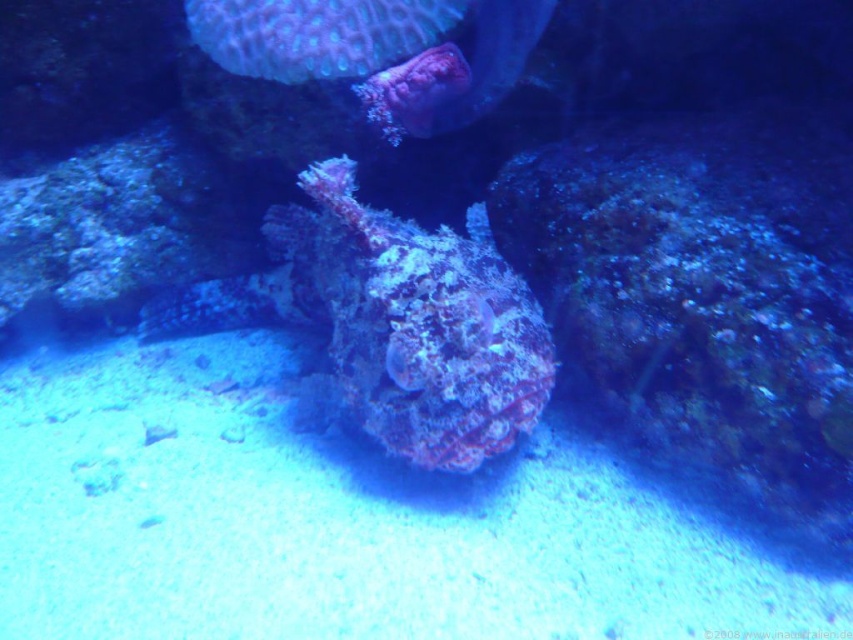
You are a marine biologist studying underwater coral formations. You notice two corals in the image, the speckled coral at center and the smooth coral at upper center. Which of these corals is bigger in size?

The speckled coral at center is larger in size than the smooth coral at upper center.

You are a marine biologist examining an underwater image. You notice two corals, the speckled coral at center and the teal textured coral at upper center. Which coral would appear larger in the image?

The speckled coral at center appears larger because it is closer to the viewer than the teal textured coral at upper center.